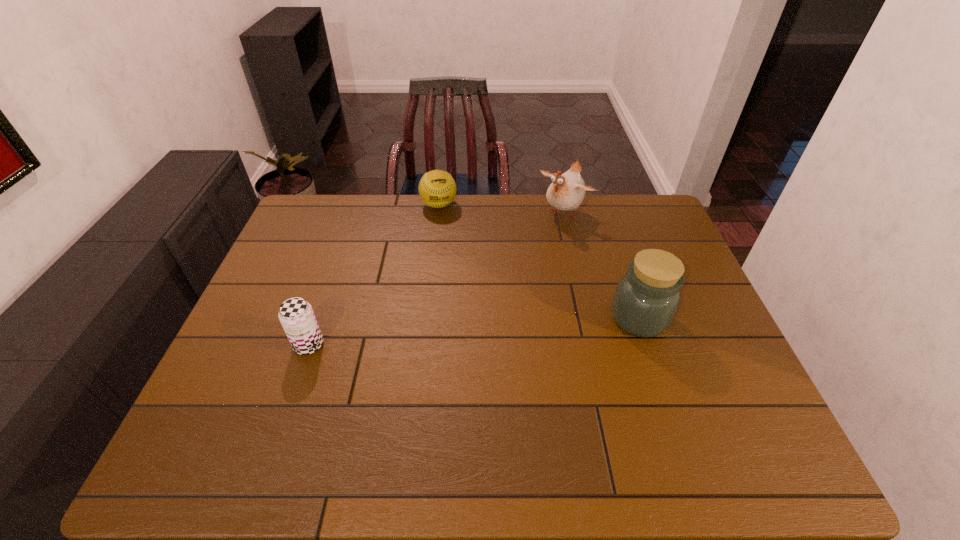
The height and width of the screenshot is (540, 960). Identify the location of vacant region at the far right corner of the desktop. (616, 207).

Find the location of `vacant space at the near right corner`. vacant space at the near right corner is located at coordinates (722, 411).

This screenshot has width=960, height=540. What are the coordinates of `vacant area that lies between the bird and the jar` in the screenshot? It's located at (602, 266).

Where is `free point between the bird and the leftmost object`? The width and height of the screenshot is (960, 540). free point between the bird and the leftmost object is located at coordinates (437, 279).

Identify the location of free spot between the jar and the bird. Image resolution: width=960 pixels, height=540 pixels. (602, 266).

Identify the location of vacant area between the jar and the bird. Image resolution: width=960 pixels, height=540 pixels. (602, 266).

Where is `free space between the bird and the leftmost object`? This screenshot has height=540, width=960. free space between the bird and the leftmost object is located at coordinates (437, 279).

The width and height of the screenshot is (960, 540). Identify the location of unoccupied area between the jar and the third object from right to left. (539, 261).

Identify the location of blank region between the bird and the jar. (602, 266).

The image size is (960, 540). I want to click on vacant space that's between the bird and the jar, so click(x=602, y=266).